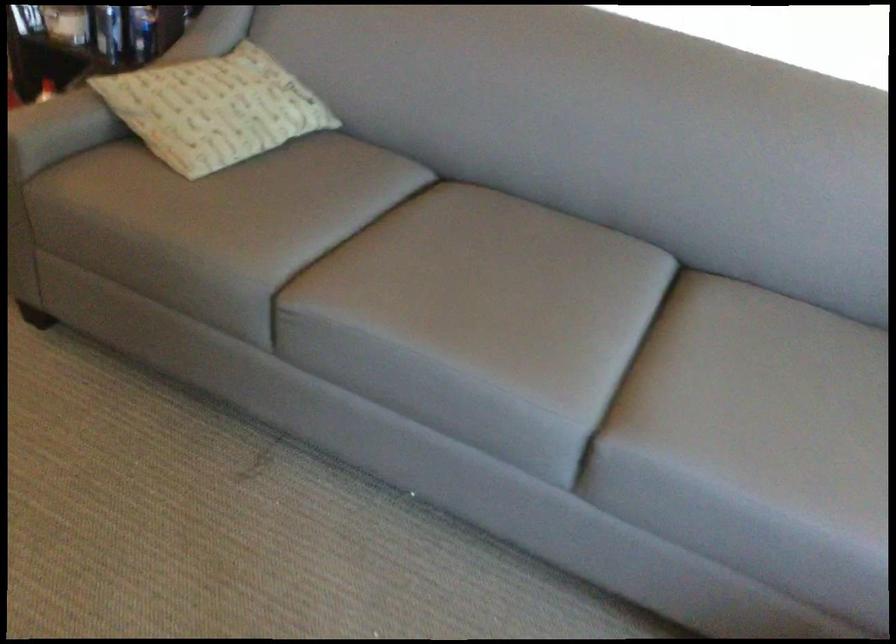
The image size is (896, 644). Identify the location of patterned throw pillow. (214, 93).